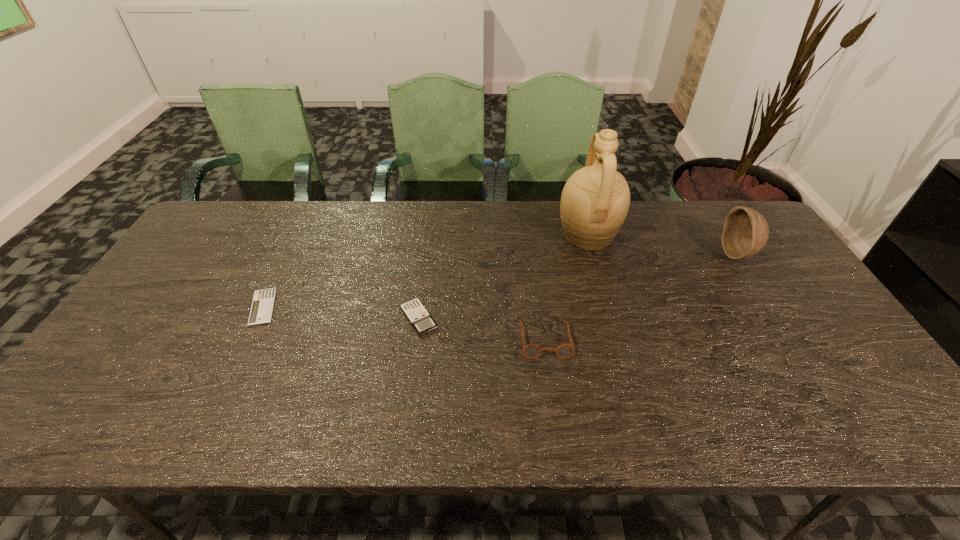
The image size is (960, 540). Find the location of `vacant region located 0.320m on the front of the second object from right to left`. vacant region located 0.320m on the front of the second object from right to left is located at coordinates (617, 341).

The height and width of the screenshot is (540, 960). Identify the location of vacant space situated on the left of the rightmost object. (680, 254).

Image resolution: width=960 pixels, height=540 pixels. I want to click on vacant position located 0.060m on the front-facing side of the third tallest object, so click(x=550, y=381).

Where is `free spot located on the right of the fourth tallest object`? This screenshot has height=540, width=960. free spot located on the right of the fourth tallest object is located at coordinates (529, 318).

I want to click on blank space located 0.330m on the back of the leftmost object, so click(x=304, y=219).

Where is `pitcher located in the far edge section of the desktop`? The height and width of the screenshot is (540, 960). pitcher located in the far edge section of the desktop is located at coordinates (595, 200).

This screenshot has height=540, width=960. Find the location of `bowl that is at the far edge`. bowl that is at the far edge is located at coordinates (745, 232).

Where is `object situated at the right edge`? The height and width of the screenshot is (540, 960). object situated at the right edge is located at coordinates (745, 232).

Where is `object located in the far right corner section of the desktop`? The height and width of the screenshot is (540, 960). object located in the far right corner section of the desktop is located at coordinates (745, 232).

Image resolution: width=960 pixels, height=540 pixels. I want to click on vacant point at the far edge, so click(549, 202).